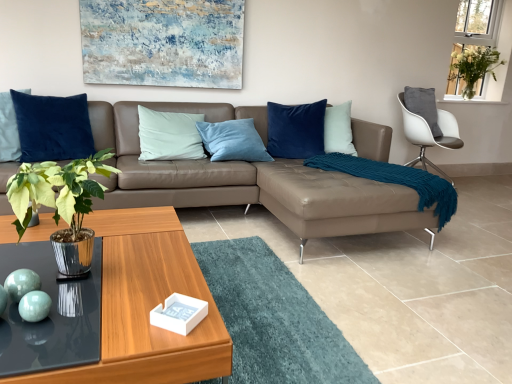
Question: Is shiny metallic plant at center-left in front of or behind white fabric chair at upper right in the image?

Choices:
 (A) behind
 (B) front

Answer: (B)

Question: From the image's perspective, is shiny metallic plant at center-left located above or below white fabric chair at upper right?

Choices:
 (A) below
 (B) above

Answer: (A)

Question: Estimate the real-world distances between objects in this image. Which object is farther from the teal glossy spheres at lower left, marked as the 2th teal in a right-to-left arrangement?

Choices:
 (A) wooden glossy coffee table at lower left
 (B) shiny metallic plant at center-left
 (C) teal glossy sphere at lower left, which appears as the first teal when viewed from the right
 (D) white glass vase at upper right
 (E) green leafy plant at upper right

Answer: (D)

Question: Based on their relative distances, which object is farther from the white glass vase at upper right?

Choices:
 (A) teal knitted blanket at right
 (B) green leafy plant at upper right
 (C) shiny metallic plant at center-left
 (D) brown leather couch at center
 (E) transparent glass table at lower left

Answer: (E)